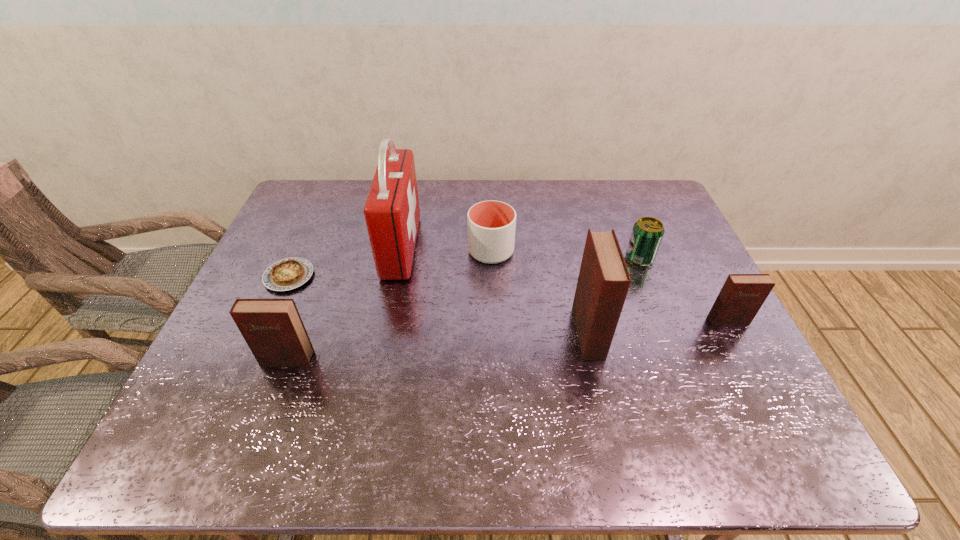
Locate which diary is the second closest to the rightmost object. Please provide its 2D coordinates. Your answer should be formatted as a tuple, i.e. [(x, y)], where the tuple contains the x and y coordinates of a point satisfying the conditions above.

[(272, 328)]

Identify which diary is located as the second nearest to the second diary from right to left. Please provide its 2D coordinates. Your answer should be formatted as a tuple, i.e. [(x, y)], where the tuple contains the x and y coordinates of a point satisfying the conditions above.

[(272, 328)]

Where is `vacant position in the image that satisfies the following two spatial constraints: 1. on the front face of the fourth object from right to left; 2. on the right side of the fifth object from right to left`? vacant position in the image that satisfies the following two spatial constraints: 1. on the front face of the fourth object from right to left; 2. on the right side of the fifth object from right to left is located at coordinates (400, 251).

Identify the location of free point that satisfies the following two spatial constraints: 1. on the front face of the tallest object; 2. on the left side of the cup. The image size is (960, 540). (400, 251).

Find the location of `vacant position in the image that satisfies the following two spatial constraints: 1. on the front cover of the rightmost diary; 2. on the front cover of the tallest diary`. vacant position in the image that satisfies the following two spatial constraints: 1. on the front cover of the rightmost diary; 2. on the front cover of the tallest diary is located at coordinates coord(733,333).

This screenshot has width=960, height=540. I want to click on free location that satisfies the following two spatial constraints: 1. on the front face of the cup; 2. on the right side of the tallest object, so click(x=400, y=251).